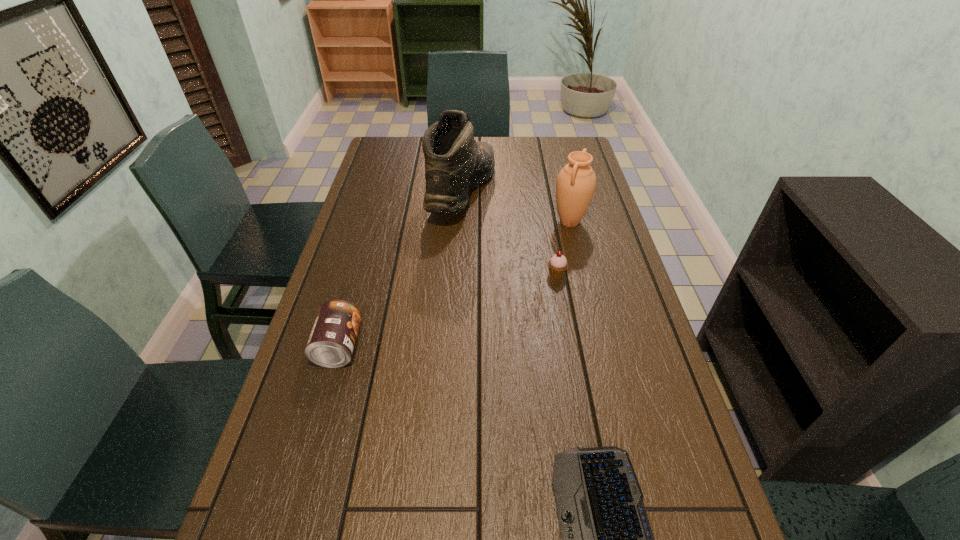
I want to click on empty space that is in between the fourth tallest object and the urn, so click(563, 248).

The height and width of the screenshot is (540, 960). Identify the location of vacant space that is in between the second nearest object and the fourth shortest object. (454, 284).

I want to click on unoccupied area between the third tallest object and the second object from left to right, so click(400, 269).

Where is `empty space between the urn and the second shortest object`? This screenshot has width=960, height=540. empty space between the urn and the second shortest object is located at coordinates (563, 248).

Where is `object that stands as the closest to the fourth object from right to left`? This screenshot has width=960, height=540. object that stands as the closest to the fourth object from right to left is located at coordinates (576, 182).

Find the location of a particular element. object that is the fourth closest to the second tallest object is located at coordinates click(x=607, y=539).

This screenshot has width=960, height=540. What are the coordinates of `vacant space that satisfies the following two spatial constraints: 1. on the front side of the fourth shortest object; 2. on the right side of the tallest object` in the screenshot? It's located at (461, 222).